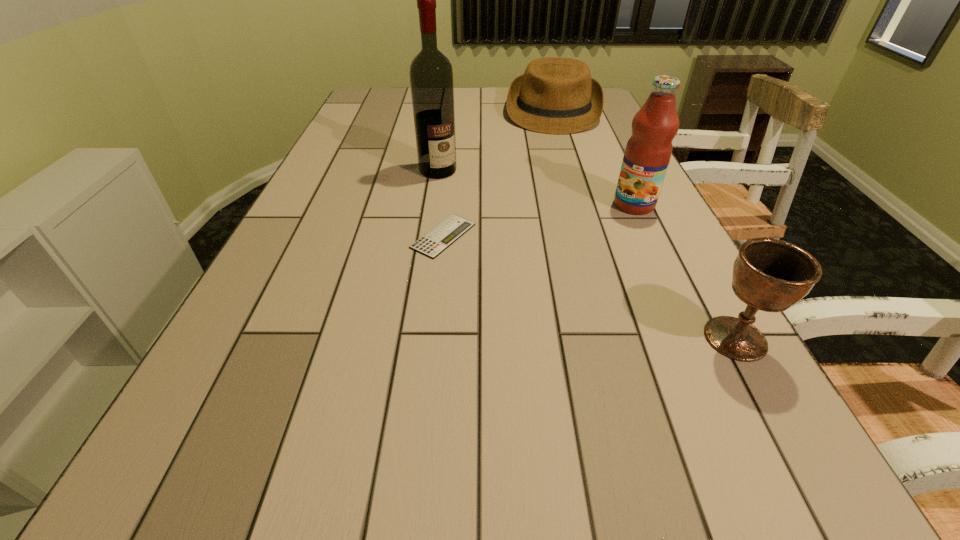
I want to click on vacant space on the desktop that is between the shortest object and the third tallest object and is positioned on the front and back of the alcohol, so click(x=537, y=269).

In order to click on free space on the desktop that is between the calculator and the third tallest object and is positioned on the front-facing side of the second shortest object in this screenshot , I will do `click(536, 268)`.

Find the location of a particular element. Image resolution: width=960 pixels, height=540 pixels. vacant space on the desktop that is between the calculator and the nearest object and is positioned on the front label of the fruit juice is located at coordinates (551, 274).